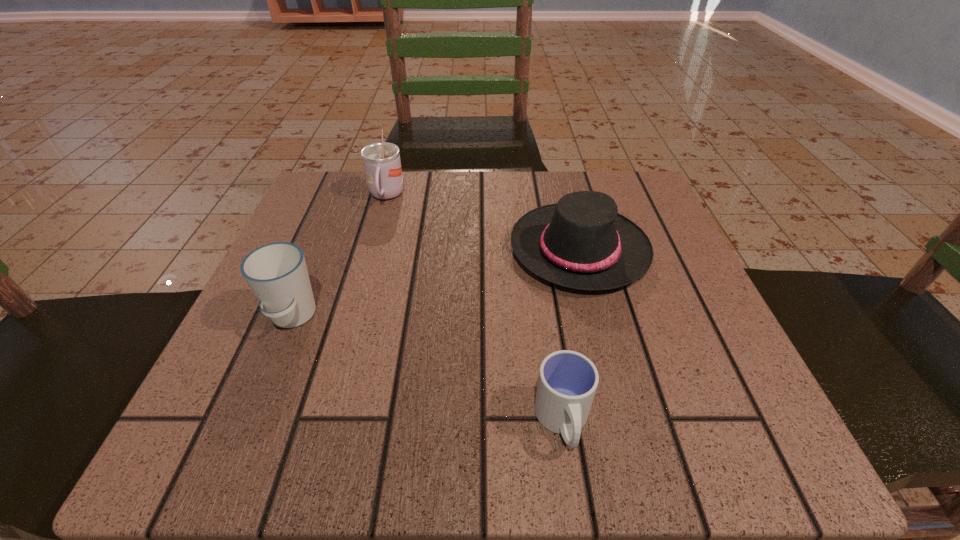
Image resolution: width=960 pixels, height=540 pixels. In the image, there is a desktop. What are the coordinates of `free space at the far left corner` in the screenshot? It's located at (368, 230).

This screenshot has height=540, width=960. In order to click on free space at the far right corner of the desktop in this screenshot , I will do `click(626, 200)`.

Locate an element on the screen. The height and width of the screenshot is (540, 960). free region at the near right corner of the desktop is located at coordinates (676, 430).

Locate an element on the screen. This screenshot has height=540, width=960. vacant region between the dress hat and the shortest cup is located at coordinates (571, 335).

Locate an element on the screen. The image size is (960, 540). free space between the second cup from right to left and the leftmost object is located at coordinates (339, 256).

Find the location of a particular element. unoccupied position between the dress hat and the farthest cup is located at coordinates (483, 223).

The width and height of the screenshot is (960, 540). What are the coordinates of `unoccupied position between the rightmost cup and the dress hat` in the screenshot? It's located at (571, 335).

Locate an element on the screen. The width and height of the screenshot is (960, 540). unoccupied area between the leftmost object and the farthest cup is located at coordinates (339, 256).

Locate an element on the screen. The height and width of the screenshot is (540, 960). unoccupied area between the second cup from right to left and the second nearest cup is located at coordinates (339, 256).

Where is `free spot between the shortest cup and the leftmost cup`? free spot between the shortest cup and the leftmost cup is located at coordinates (427, 369).